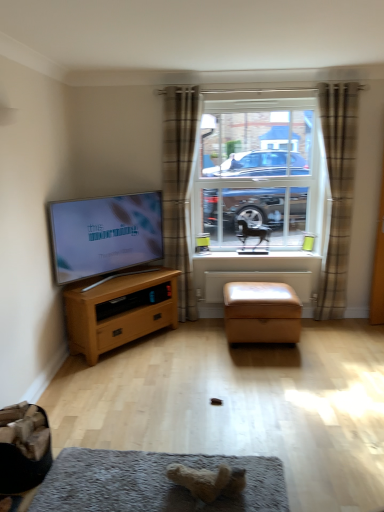
At what (x,y) coordinates should I click in order to perform the action: click on vacant space in front of wooden chest of drawers at left. Please return your answer as a coordinate pair (x, y). Looking at the image, I should click on [x=134, y=376].